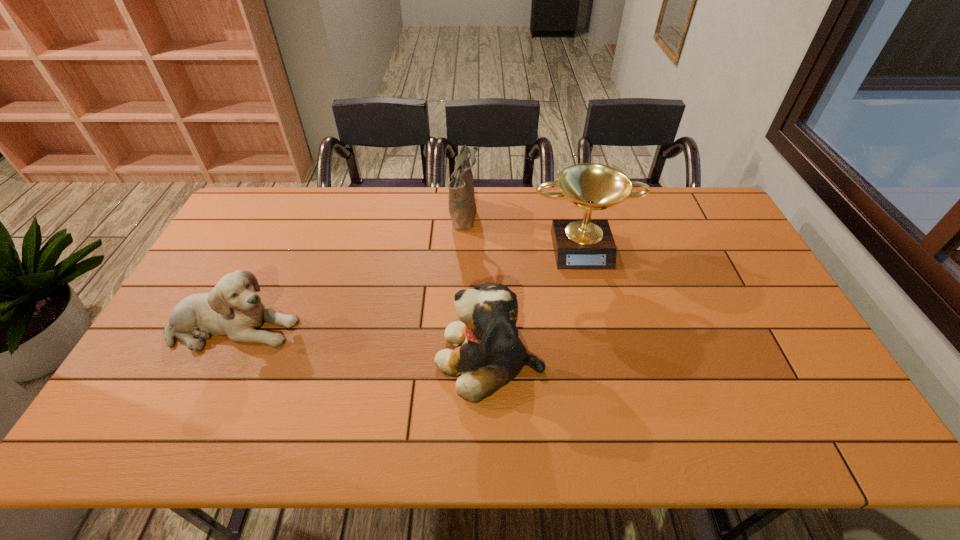
Find the location of a particular element. The image size is (960, 540). vacant space located 0.100m on the front-facing side of the shorter puppy is located at coordinates (334, 327).

Identify the location of shoulder bag at the far edge. This screenshot has height=540, width=960. (461, 201).

This screenshot has height=540, width=960. Find the location of `award present at the far edge`. award present at the far edge is located at coordinates (586, 243).

Where is `object situated at the left edge`? The height and width of the screenshot is (540, 960). object situated at the left edge is located at coordinates (233, 308).

In the image, there is a desktop. What are the coordinates of `blank space at the far edge` in the screenshot? It's located at (478, 226).

In the image, there is a desktop. In order to click on vacant space at the near edge in this screenshot , I will do `click(688, 420)`.

Image resolution: width=960 pixels, height=540 pixels. I want to click on vacant region at the left edge of the desktop, so click(174, 368).

In the image, there is a desktop. Identify the location of free space at the right edge. The height and width of the screenshot is (540, 960). (716, 281).

Locate an element on the screen. Image resolution: width=960 pixels, height=540 pixels. free space at the near left corner is located at coordinates (171, 419).

The width and height of the screenshot is (960, 540). In the image, there is a desktop. What are the coordinates of `vacant space at the far right corner` in the screenshot? It's located at (705, 198).